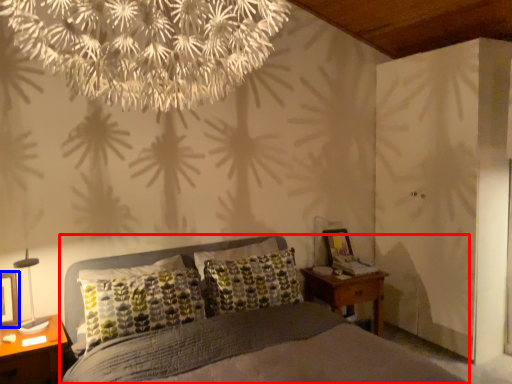
Question: Which object appears farthest to the camera in this image, bed (highlighted by a red box) or picture frame (highlighted by a blue box)?

Choices:
 (A) bed
 (B) picture frame

Answer: (B)